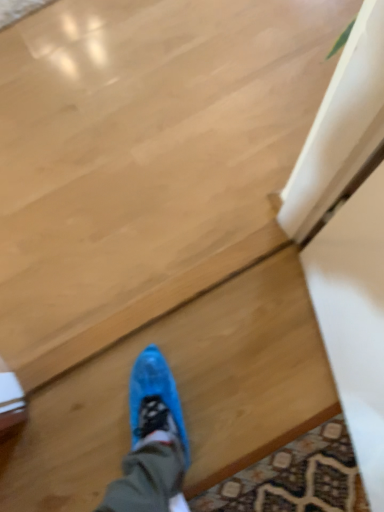
Locate an element on the screen. Image resolution: width=384 pixels, height=512 pixels. free space above blue plastic shoe at center (from a real-world perspective) is located at coordinates (220, 416).